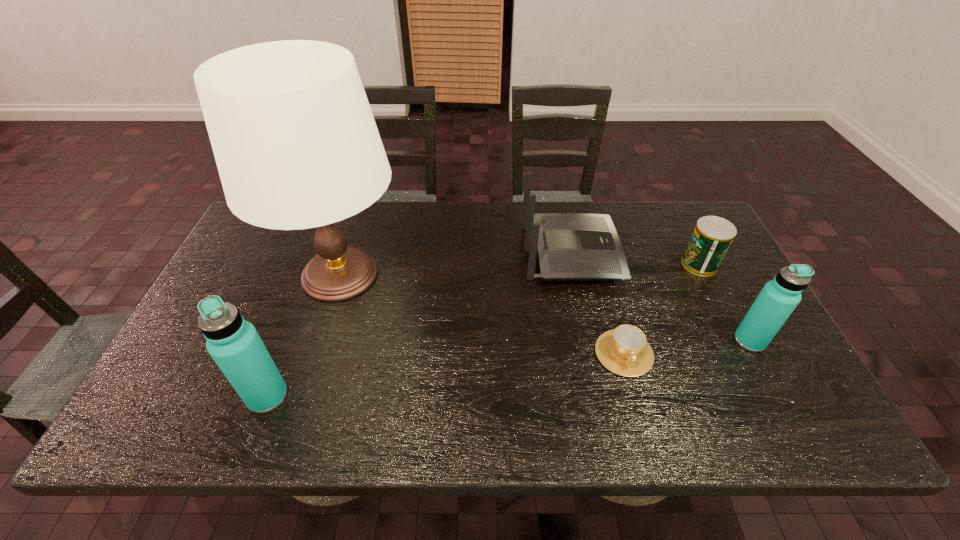
The width and height of the screenshot is (960, 540). I want to click on vacant space positioned 0.320m on the front-facing side of the fourth tallest object, so click(x=724, y=253).

Identify the location of free space located 0.150m on the left of the tallest object. The image size is (960, 540). (223, 275).

At what (x,y) coordinates should I click in order to perform the action: click on vacant space located 0.220m on the left of the can. Please return your answer as a coordinate pair (x, y). Image resolution: width=960 pixels, height=540 pixels. Looking at the image, I should click on (608, 265).

Image resolution: width=960 pixels, height=540 pixels. I want to click on router that is at the far edge, so click(x=571, y=246).

Locate an element on the screen. This screenshot has height=540, width=960. lamp at the far edge is located at coordinates (296, 145).

Identify the location of water bottle that is at the near edge. The image size is (960, 540). (234, 344).

Where is `cup located at the near edge`? Image resolution: width=960 pixels, height=540 pixels. cup located at the near edge is located at coordinates (624, 351).

At what (x,y) coordinates should I click in order to perform the action: click on object located at the left edge. Please return your answer as a coordinate pair (x, y). This screenshot has width=960, height=540. Looking at the image, I should click on (296, 145).

Locate an element on the screen. This screenshot has width=960, height=540. water bottle at the right edge is located at coordinates (779, 297).

I want to click on can located in the right edge section of the desktop, so click(x=712, y=236).